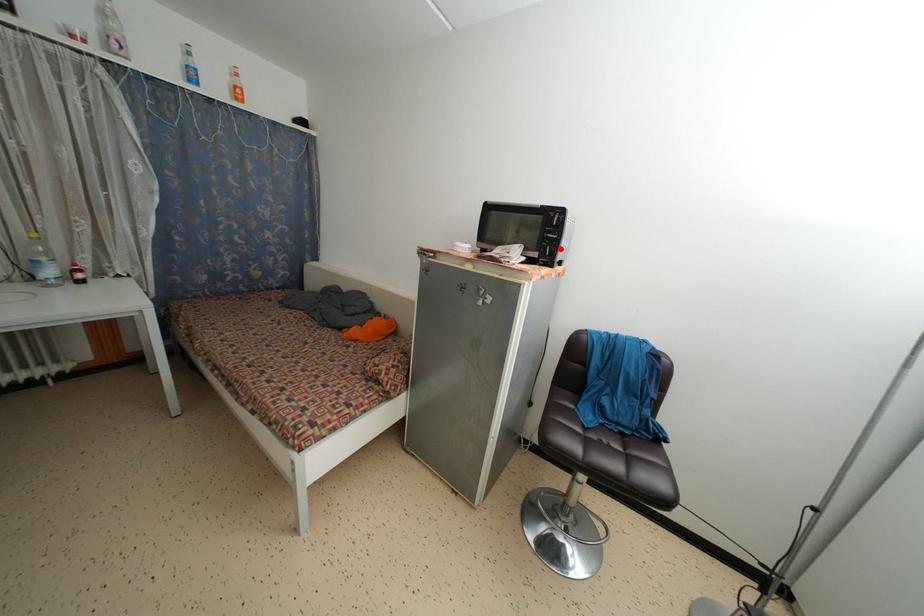
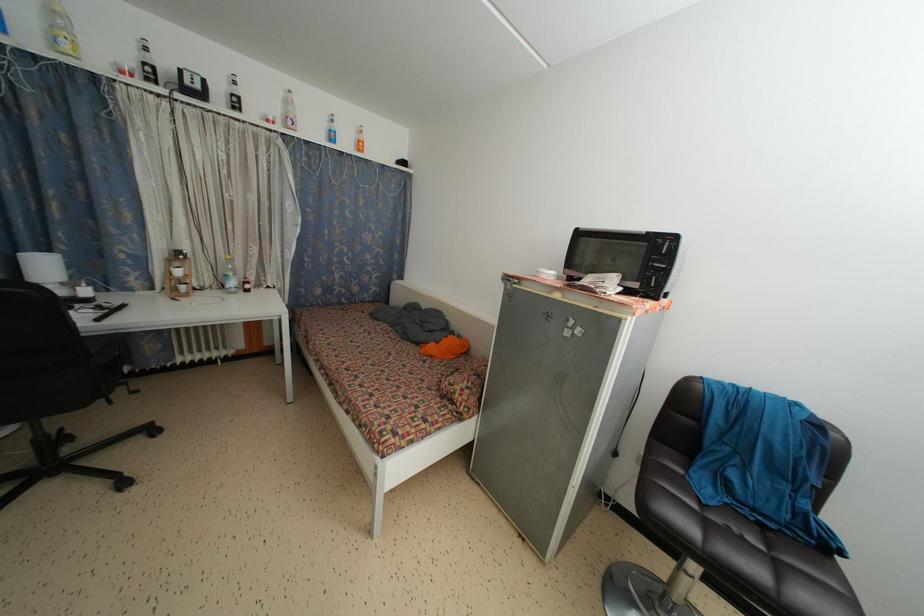
Find the pixel in the second image that matches the highlighted location in the first image.

(669, 280)